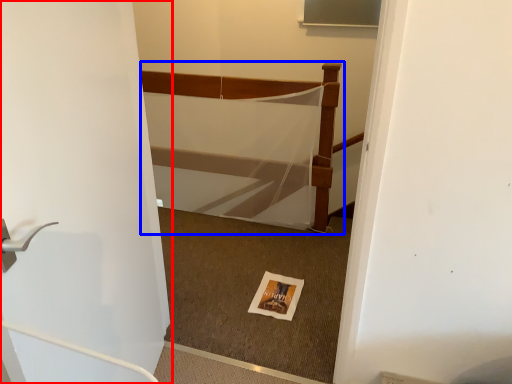
Question: Among these objects, which one is nearest to the camera, door (highlighted by a red box) or bed (highlighted by a blue box)?

Choices:
 (A) door
 (B) bed

Answer: (A)